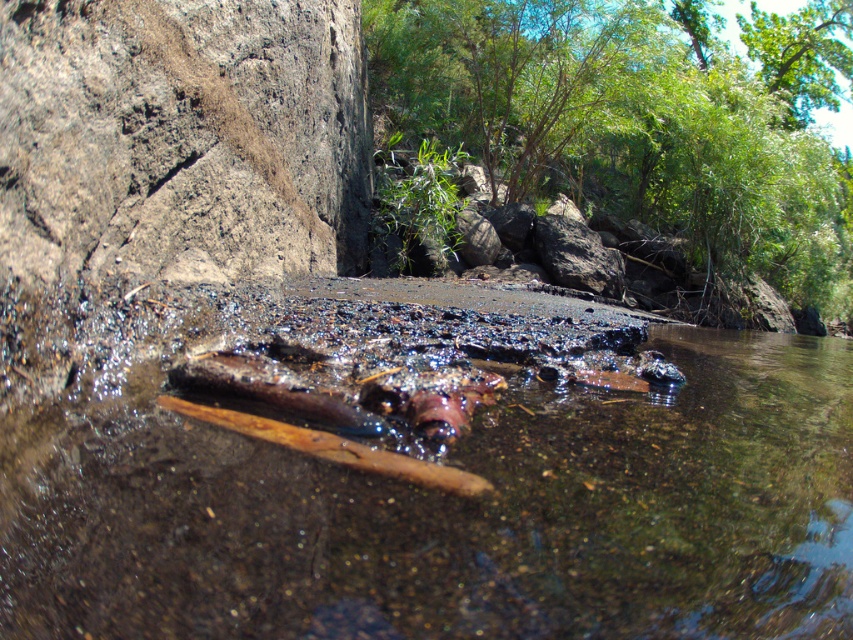
Question: Is the position of brown wood at center less distant than that of rough textured rock at left?

Choices:
 (A) no
 (B) yes

Answer: (B)

Question: Which object is closer to the camera taking this photo?

Choices:
 (A) brown wood at center
 (B) rough textured rock at left

Answer: (A)

Question: Can you confirm if brown wood at center is smaller than rough textured rock at left?

Choices:
 (A) no
 (B) yes

Answer: (A)

Question: Which object is farther from the camera taking this photo?

Choices:
 (A) rough textured rock at left
 (B) brown wood at center

Answer: (A)

Question: Does brown wood at center appear on the left side of rough textured rock at left?

Choices:
 (A) yes
 (B) no

Answer: (B)